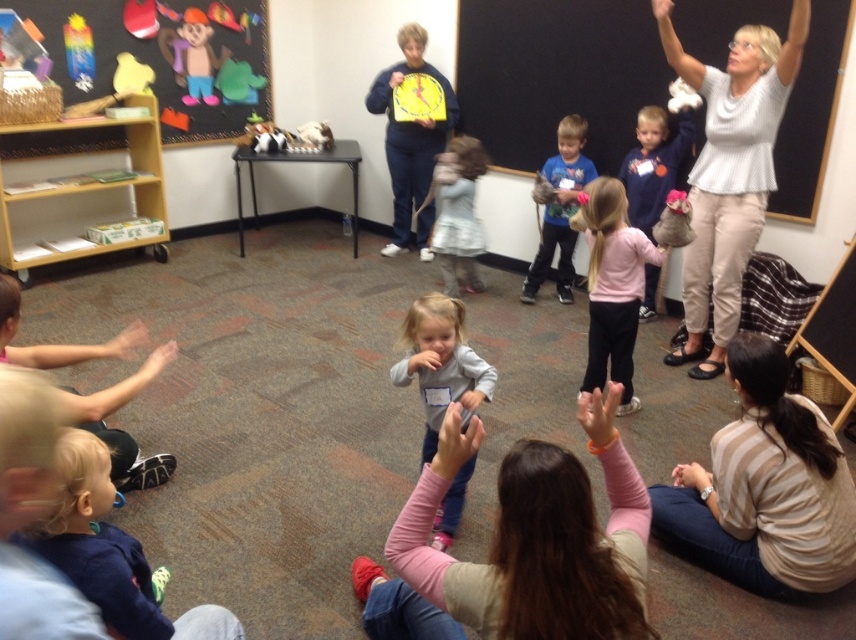
You are a teacher in the classroom and want to hand out a worksheet to the student wearing the striped sweater at lower right and the student wearing the pink fleece jacket at center. Which student should you approach first if you want to give the worksheet to the one closer to the chalkboard?

The striped sweater at lower right is positioned on the left side of pink fleece jacket at center. Since the chalkboard is in the background, the student wearing the striped sweater at lower right is closer to the chalkboard. Therefore, you should approach the student wearing the striped sweater at lower right first.

You are a teacher in the classroom and want to place a new poster on the wall. The poster is 1 meter tall. You have two options to choose from for hanging it. The first option is above the striped sweater at lower right, and the second option is above the matte cardboard shelf at upper left. Which location will allow the poster to fit vertically without being cut off?

The poster will fit better above the matte cardboard shelf at upper left because the striped sweater at lower right is not as tall as the matte cardboard shelf at upper left, meaning the shelf provides more vertical space.

You are a teacher standing in front of the classroom. You need to hang a large poster that requires 2 meters of vertical space. Which object between the blackboard at upper right and the matte cardboard shelf at upper left would be suitable for hanging the poster?

The blackboard at upper right has a greater height compared to the matte cardboard shelf at upper left, so it would be suitable for hanging the poster that requires 2 meters of vertical space.